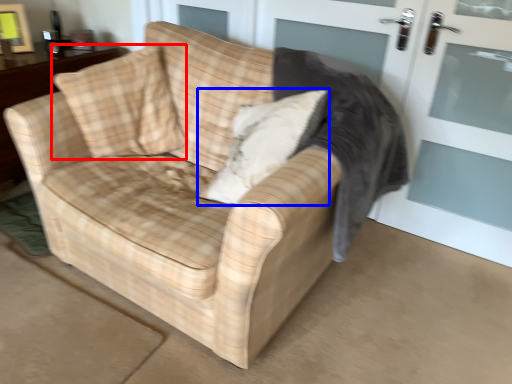
Question: Which object is closer to the camera taking this photo, throw pillow (highlighted by a red box) or throw pillow (highlighted by a blue box)?

Choices:
 (A) throw pillow
 (B) throw pillow

Answer: (B)